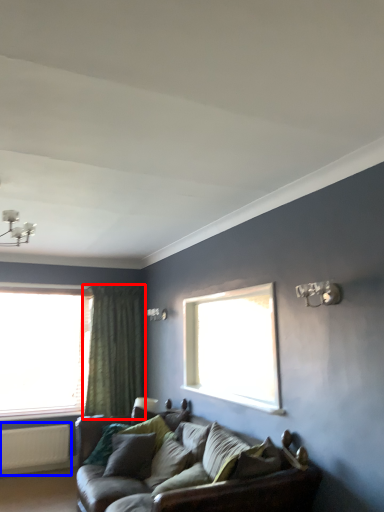
Question: Which object is further to the camera taking this photo, curtain (highlighted by a red box) or radiator (highlighted by a blue box)?

Choices:
 (A) curtain
 (B) radiator

Answer: (A)